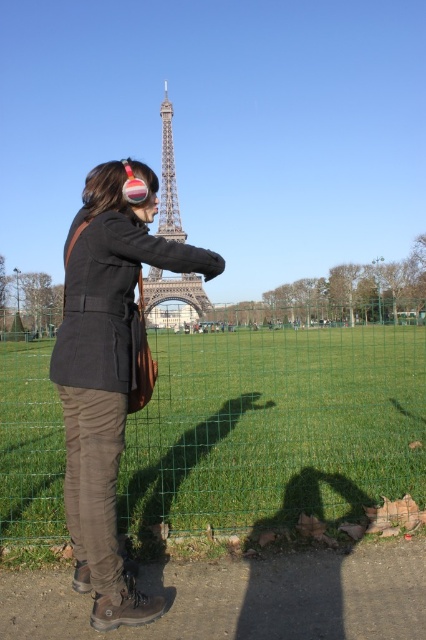
Can you confirm if green wire mesh fence at center is positioned to the left of matte black jacket at center?

In fact, green wire mesh fence at center is to the right of matte black jacket at center.

Who is more distant from viewer, (377, 481) or (106, 184)?

Point (106, 184)

You are a GUI agent. You are given a task and a screenshot of the screen. Output one action in this format:
    pyautogui.click(x=<x>, y=<y>)
    Task: Click on the green wire mesh fence at center
    The image size is (426, 640).
    Given the screenshot: What is the action you would take?
    pyautogui.click(x=276, y=428)

Is point (71, 340) behind point (164, 202)?

No, (71, 340) is in front of (164, 202).

Based on the photo, is matte black jacket at center bigger than metallic silver eiffel tower at center?

Indeed, matte black jacket at center has a larger size compared to metallic silver eiffel tower at center.

The height and width of the screenshot is (640, 426). Find the location of `matte black jacket at center`. matte black jacket at center is located at coordinates (109, 371).

Based on the photo, does green wire mesh fence at center appear over metallic silver eiffel tower at center?

Incorrect, green wire mesh fence at center is not positioned above metallic silver eiffel tower at center.

Can you confirm if green wire mesh fence at center is positioned below metallic silver eiffel tower at center?

Indeed, green wire mesh fence at center is positioned under metallic silver eiffel tower at center.

What do you see at coordinates (276, 428) in the screenshot? The image size is (426, 640). I see `green wire mesh fence at center` at bounding box center [276, 428].

Locate an element on the screen. green wire mesh fence at center is located at coordinates (276, 428).